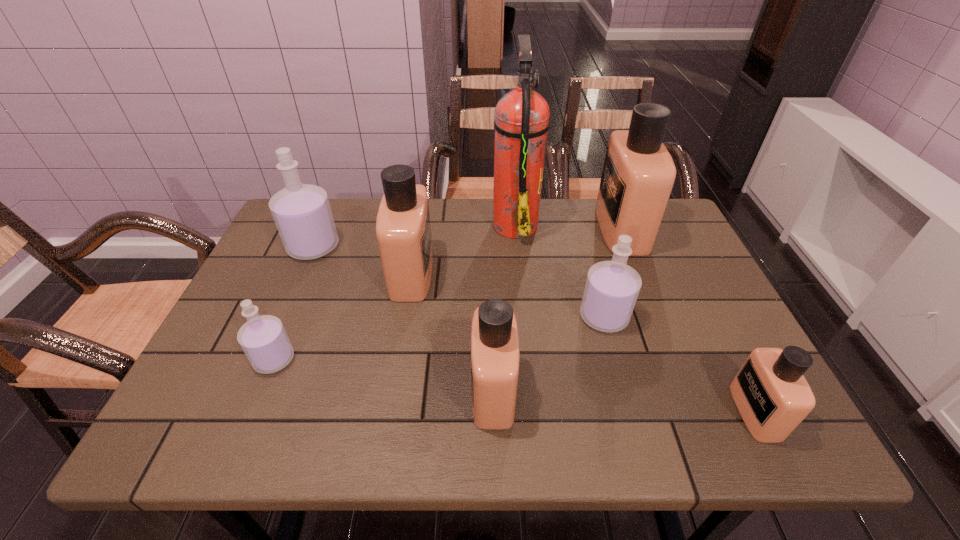
Identify the location of blank space located on the front of the farthest purple perfume. (277, 328).

Locate an element on the screen. The height and width of the screenshot is (540, 960). vacant area located on the right of the third object from right to left is located at coordinates (683, 317).

Where is `vacant space located 0.260m on the front label of the third biggest beige perfume`? vacant space located 0.260m on the front label of the third biggest beige perfume is located at coordinates (346, 391).

Where is `vacant space situated 0.380m on the front label of the third biggest beige perfume`? This screenshot has height=540, width=960. vacant space situated 0.380m on the front label of the third biggest beige perfume is located at coordinates (287, 391).

In order to click on vacant space positioned 0.160m on the front label of the third biggest beige perfume in this screenshot , I will do `click(394, 391)`.

The width and height of the screenshot is (960, 540). Identify the location of free region located 0.210m on the right of the smallest purple perfume. (390, 360).

The height and width of the screenshot is (540, 960). In order to click on free spot located 0.250m on the front label of the rightmost object in this screenshot , I will do `click(612, 412)`.

The image size is (960, 540). What are the coordinates of `vacant space located 0.240m on the front label of the rightmost object` in the screenshot? It's located at (617, 412).

The width and height of the screenshot is (960, 540). I want to click on blank space located 0.080m on the front label of the rightmost object, so click(x=698, y=412).

You are a GUI agent. You are given a task and a screenshot of the screen. Output one action in this format:
    pyautogui.click(x=<x>, y=<y>)
    Task: Click on the fire extinguisher located at the far edge
    The width and height of the screenshot is (960, 540).
    Given the screenshot: What is the action you would take?
    pyautogui.click(x=521, y=123)